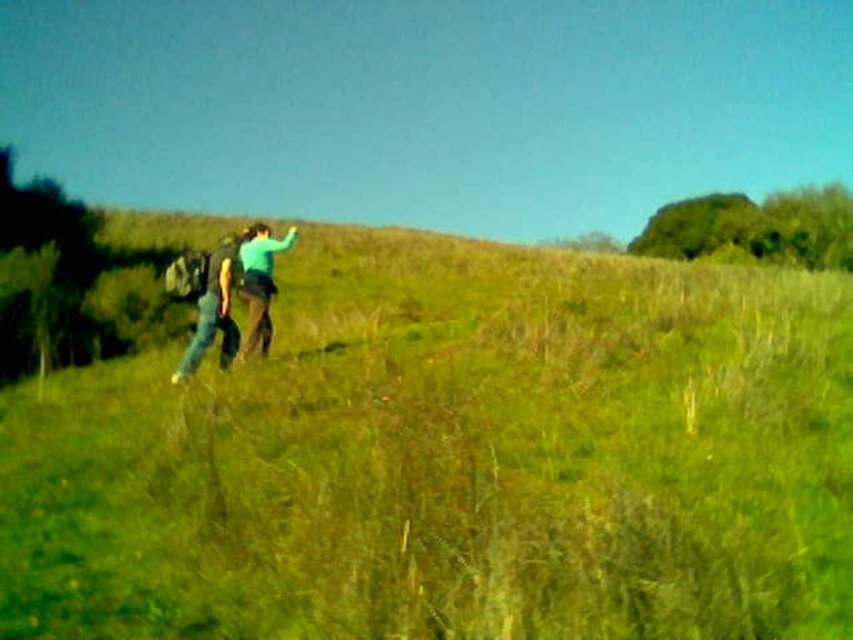
Question: Which object is positioned farthest from the denim pants at left?

Choices:
 (A) green grassy hillside at center
 (B) green matte jacket at center

Answer: (A)

Question: Does green grassy hillside at center appear on the right side of green matte jacket at center?

Choices:
 (A) yes
 (B) no

Answer: (A)

Question: Which object is farther from the camera taking this photo?

Choices:
 (A) denim pants at left
 (B) green matte jacket at center
 (C) green grassy hillside at center

Answer: (B)

Question: Is green grassy hillside at center below denim pants at left?

Choices:
 (A) no
 (B) yes

Answer: (A)

Question: Among these objects, which one is farthest from the camera?

Choices:
 (A) denim pants at left
 (B) green grassy hillside at center
 (C) green matte jacket at center

Answer: (C)

Question: Is denim pants at left positioned in front of green matte jacket at center?

Choices:
 (A) no
 (B) yes

Answer: (B)